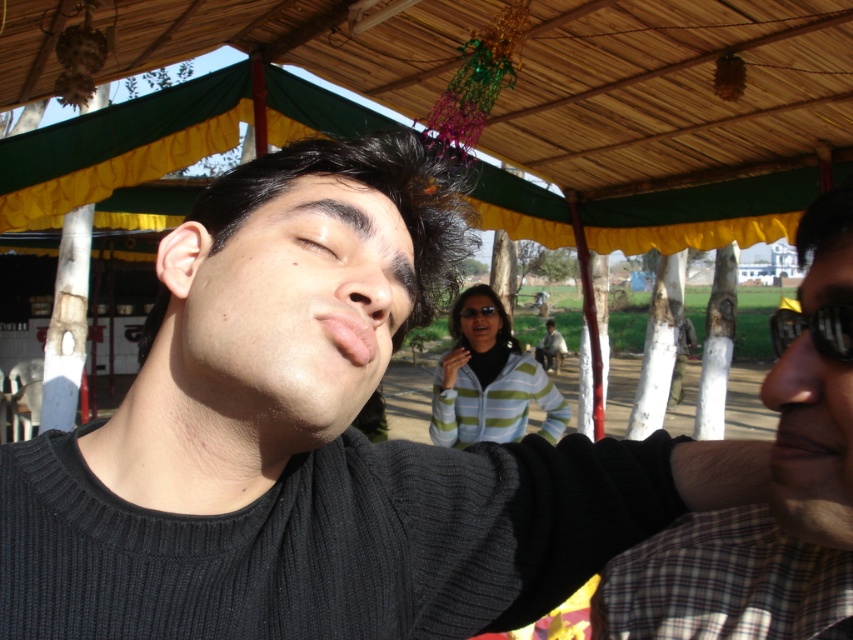
Question: Is checkered fabric shirt at right behind black rubber goggles at right?

Choices:
 (A) no
 (B) yes

Answer: (A)

Question: Which object is positioned closest to the green fabric canopy at upper center?

Choices:
 (A) black rubber goggles at right
 (B) checkered fabric shirt at right
 (C) brown matte eye at center

Answer: (B)

Question: Can you confirm if green fabric canopy at upper center is smaller than checkered fabric shirt at right?

Choices:
 (A) no
 (B) yes

Answer: (A)

Question: Which of these objects is positioned farthest from the brown matte eye at center?

Choices:
 (A) black rubber goggles at right
 (B) green fabric canopy at upper center
 (C) striped knit sweater at center

Answer: (C)

Question: In this image, where is green fabric canopy at upper center located relative to black rubber goggles at right?

Choices:
 (A) right
 (B) left

Answer: (B)

Question: Which of these objects is positioned farthest from the black rubber goggles at right?

Choices:
 (A) green fabric canopy at upper center
 (B) striped knit sweater at center

Answer: (A)